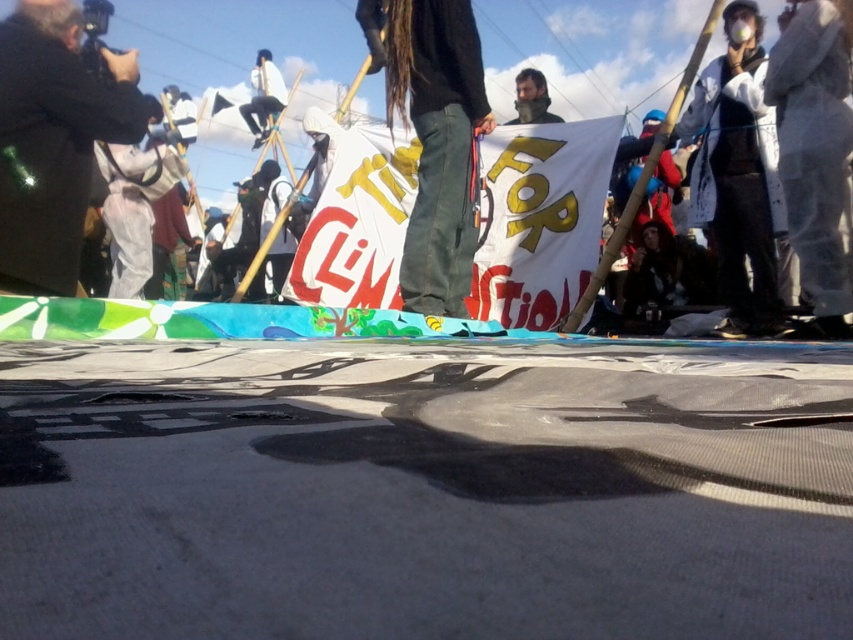
You are a photographer trying to capture a clear shot of the white fabric mask at upper right and the smooth black jacket at upper center. Based on their sizes in the image, which object would appear larger in your photo?

The white fabric mask at upper right appears much larger than the smooth black jacket at upper center in the image.

You are a photographer standing at the back of the crowd. You want to capture a photo that includes both the dark gray jacket at left and the smooth black jacket at upper center. Given that your camera has a focal length of 50mm, which is suitable for portraits, will the distance between them allow both jackets to be in the frame without needing to adjust your position?

The dark gray jacket at left and smooth black jacket at upper center are 8.08 feet apart. At 50mm focal length, the field of view typically allows for capturing subjects within 8 feet comfortably. Therefore, both jackets can be included in the frame without moving.

Based on the photo, you are a photographer trying to capture the white fabric mask at upper right and the smooth black jacket at upper center in the same frame. Based on their positions, which object would appear closer to the camera in the photo?

The white fabric mask at upper right appears closer to the camera because it is in front of the smooth black jacket at upper center.